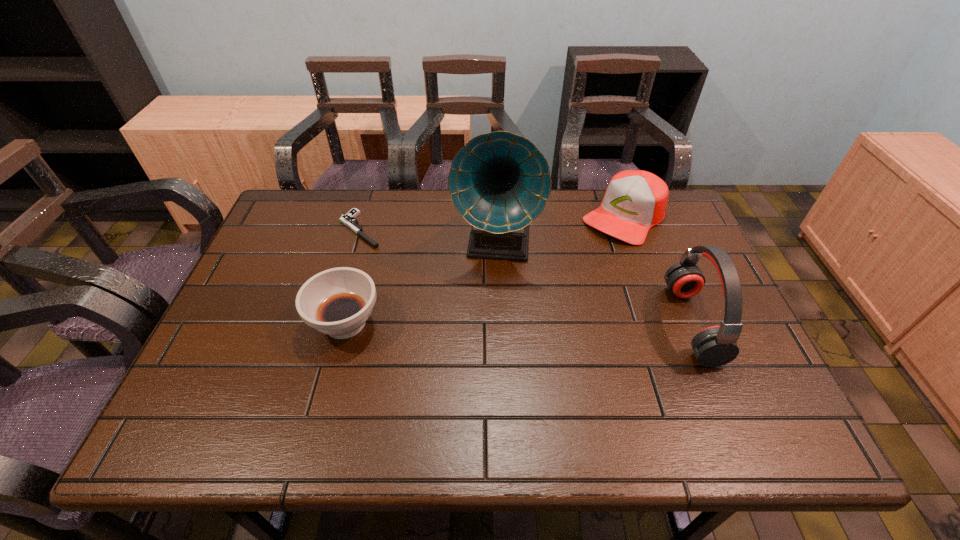
You are a GUI agent. You are given a task and a screenshot of the screen. Output one action in this format:
    pyautogui.click(x=<x>, y=<y>)
    Task: Click on the free space located 0.050m from the horn of the third object from left to right
    The height and width of the screenshot is (540, 960).
    Given the screenshot: What is the action you would take?
    pyautogui.click(x=491, y=291)

The height and width of the screenshot is (540, 960). I want to click on vacant space situated on the front-facing side of the pistol, so click(x=388, y=254).

Identify the location of vacant space located 0.200m on the front-facing side of the pistol. The image size is (960, 540). (419, 276).

This screenshot has height=540, width=960. I want to click on free point located 0.160m on the front-facing side of the pistol, so click(x=409, y=269).

Identify the location of vacant space located 0.260m on the front-facing side of the baseball cap. point(558,290).

Locate an element on the screen. free location located on the front-facing side of the baseball cap is located at coordinates (596, 248).

This screenshot has width=960, height=540. Find the location of `vacant space located 0.260m on the front-facing side of the baseball cap`. vacant space located 0.260m on the front-facing side of the baseball cap is located at coordinates (558, 290).

Where is `phonograph_record that is at the far edge`? phonograph_record that is at the far edge is located at coordinates (499, 182).

You are a GUI agent. You are given a task and a screenshot of the screen. Output one action in this format:
    pyautogui.click(x=<x>, y=<y>)
    Task: Click on the pistol present at the far edge
    This screenshot has height=540, width=960.
    Given the screenshot: What is the action you would take?
    pyautogui.click(x=348, y=219)

You are a GUI agent. You are given a task and a screenshot of the screen. Output one action in this format:
    pyautogui.click(x=<x>, y=<y>)
    Task: Click on the baseball cap situated at the far edge
    
    Given the screenshot: What is the action you would take?
    pyautogui.click(x=635, y=200)